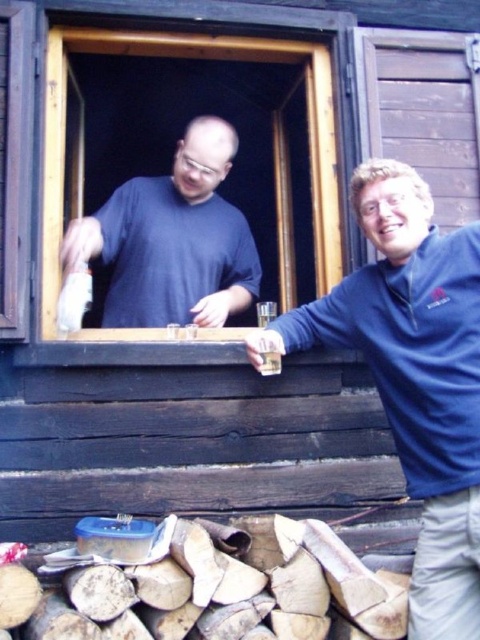
Does point (144, 260) come closer to viewer compared to point (264, 372)?

That is False.

Is the position of matte blue shirt at window more distant than that of translucent glass beverage at window?

Yes.

Between point (189, 177) and point (276, 358), which one is positioned in front?

Positioned in front is point (276, 358).

Image resolution: width=480 pixels, height=640 pixels. What are the coordinates of `matte blue shirt at window` in the screenshot? It's located at (173, 240).

Which is in front, point (218, 240) or point (49, 310)?

Point (49, 310) is more forward.

Is point (229, 161) more distant than point (327, 52)?

Yes, point (229, 161) is farther from viewer.

This screenshot has height=640, width=480. What are the coordinates of `matte blue shirt at window` in the screenshot? It's located at (173, 240).

Can you confirm if blue fleece jacket at right is thinner than translucent glass beverage at window?

No, blue fleece jacket at right is not thinner than translucent glass beverage at window.

Which of these two, blue fleece jacket at right or translucent glass beverage at window, stands taller?

blue fleece jacket at right

Is point (467, 516) farther from viewer compared to point (263, 365)?

No, it is in front of (263, 365).

Image resolution: width=480 pixels, height=640 pixels. In order to click on blue fleece jacket at right in this screenshot , I will do `click(415, 376)`.